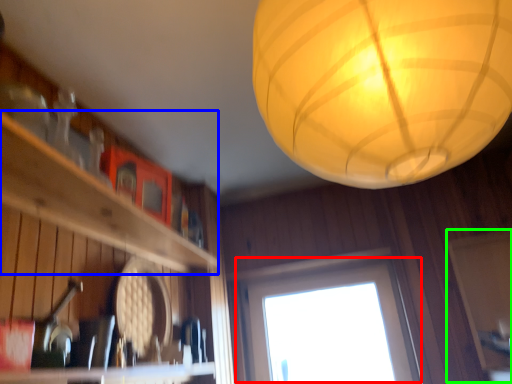
Question: Which object is the closest to the window (highlighted by a red box)? Choose among these: shelf (highlighted by a blue box) or screen door (highlighted by a green box).

Choices:
 (A) shelf
 (B) screen door

Answer: (B)